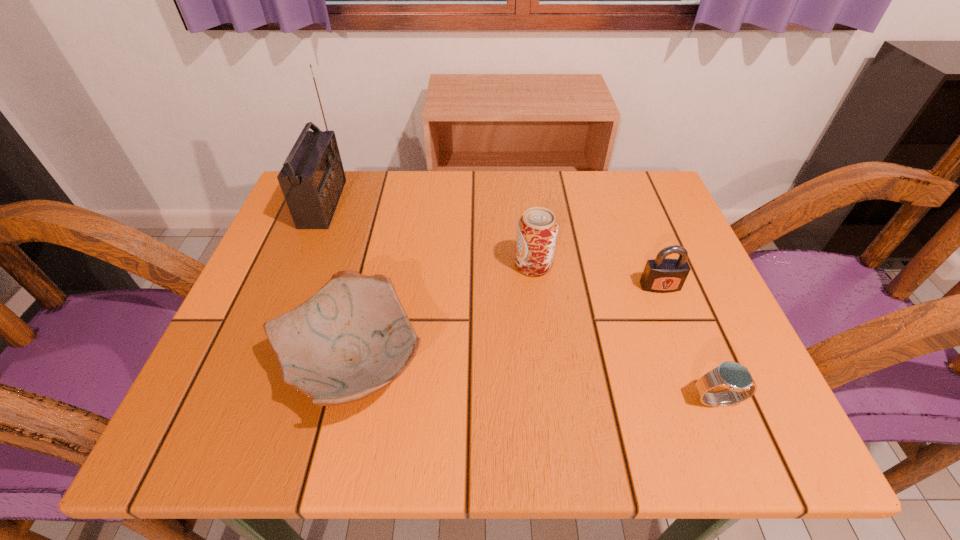
What are the coordinates of `vacant space that satisfies the following two spatial constraints: 1. on the front panel of the beer can; 2. on the left side of the tallest object` in the screenshot? It's located at (299, 265).

You are a GUI agent. You are given a task and a screenshot of the screen. Output one action in this format:
    pyautogui.click(x=<x>, y=<y>)
    Task: Click on the free region that satisfies the following two spatial constraints: 1. on the front panel of the beer can; 2. on the right side of the farthest object
    
    Given the screenshot: What is the action you would take?
    pyautogui.click(x=299, y=265)

Find the location of a particular element. This screenshot has height=540, width=960. vacant space that satisfies the following two spatial constraints: 1. on the front of the shortest object near the keyhole; 2. on the right side of the third nearest object is located at coordinates (704, 400).

What are the coordinates of `vacant position in the image that satisfies the following two spatial constraints: 1. on the back side of the pottery; 2. on the front panel of the tallest object` in the screenshot? It's located at (390, 204).

The height and width of the screenshot is (540, 960). What are the coordinates of `vacant area that satisfies the following two spatial constraints: 1. on the front of the third farthest object near the keyhole; 2. on the left side of the shortest object` in the screenshot? It's located at (704, 400).

Identify the location of free location that satisfies the following two spatial constraints: 1. on the front panel of the farthest object; 2. on the left side of the shortest object. (243, 400).

Where is `free location that satisfies the following two spatial constraints: 1. on the front panel of the tallest object; 2. on the right side of the pottery`? The height and width of the screenshot is (540, 960). free location that satisfies the following two spatial constraints: 1. on the front panel of the tallest object; 2. on the right side of the pottery is located at coordinates (258, 363).

Find the location of a particular element. The image size is (960, 540). free space that satisfies the following two spatial constraints: 1. on the front of the watch near the keyhole; 2. on the right side of the third farthest object is located at coordinates (704, 400).